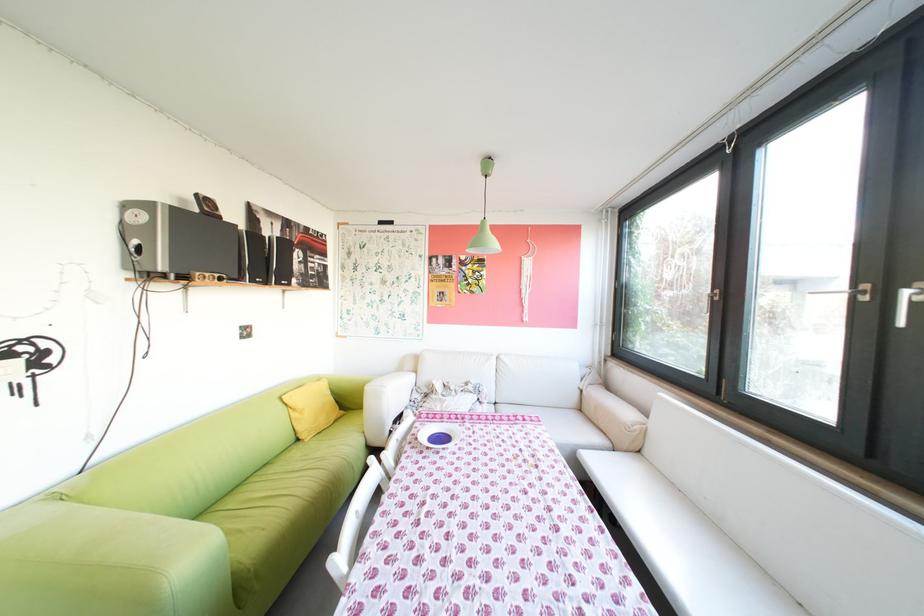
At what (x,y) coordinates should I click in order to perform the action: click on green sofa surface. Please return your answer as a coordinate pair (x, y). Looking at the image, I should click on (300, 479).